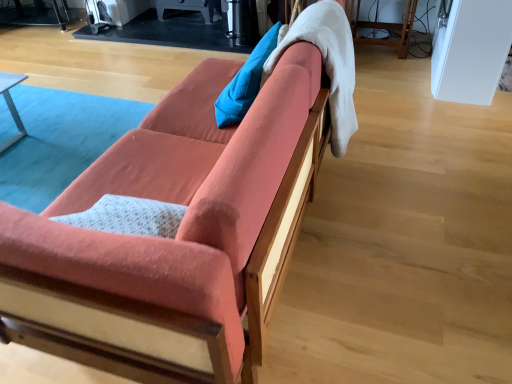
Question: Is the position of blue fabric pillow at upper center less distant than that of white soft blanket at upper right?

Choices:
 (A) yes
 (B) no

Answer: (B)

Question: Can you confirm if blue fabric pillow at upper center is thinner than white soft blanket at upper right?

Choices:
 (A) yes
 (B) no

Answer: (A)

Question: Can you confirm if blue fabric pillow at upper center is taller than white soft blanket at upper right?

Choices:
 (A) yes
 (B) no

Answer: (B)

Question: Can you confirm if blue fabric pillow at upper center is positioned to the right of white soft blanket at upper right?

Choices:
 (A) yes
 (B) no

Answer: (B)

Question: Considering the relative sizes of blue fabric pillow at upper center and white soft blanket at upper right in the image provided, is blue fabric pillow at upper center wider than white soft blanket at upper right?

Choices:
 (A) yes
 (B) no

Answer: (B)

Question: Considering the relative positions of coral fabric couch at center and white soft blanket at upper right in the image provided, is coral fabric couch at center to the left or to the right of white soft blanket at upper right?

Choices:
 (A) right
 (B) left

Answer: (B)

Question: Considering the positions of coral fabric couch at center and white soft blanket at upper right in the image, is coral fabric couch at center bigger or smaller than white soft blanket at upper right?

Choices:
 (A) small
 (B) big

Answer: (B)

Question: From a real-world perspective, relative to white soft blanket at upper right, is coral fabric couch at center vertically above or below?

Choices:
 (A) below
 (B) above

Answer: (A)

Question: In terms of width, does coral fabric couch at center look wider or thinner when compared to white soft blanket at upper right?

Choices:
 (A) thin
 (B) wide

Answer: (B)

Question: From the image's perspective, is white soft blanket at upper right located above or below blue fabric pillow at upper center?

Choices:
 (A) below
 (B) above

Answer: (A)

Question: Looking at the image, does white soft blanket at upper right seem bigger or smaller compared to blue fabric pillow at upper center?

Choices:
 (A) big
 (B) small

Answer: (A)

Question: Is white soft blanket at upper right inside or outside of blue fabric pillow at upper center?

Choices:
 (A) inside
 (B) outside

Answer: (B)

Question: Considering the positions of point click(274, 51) and point click(216, 112), is point click(274, 51) closer or farther from the camera than point click(216, 112)?

Choices:
 (A) closer
 (B) farther

Answer: (A)

Question: Is blue fabric pillow at upper center in front of or behind coral fabric couch at center in the image?

Choices:
 (A) front
 (B) behind

Answer: (B)

Question: Is blue fabric pillow at upper center bigger or smaller than coral fabric couch at center?

Choices:
 (A) big
 (B) small

Answer: (B)